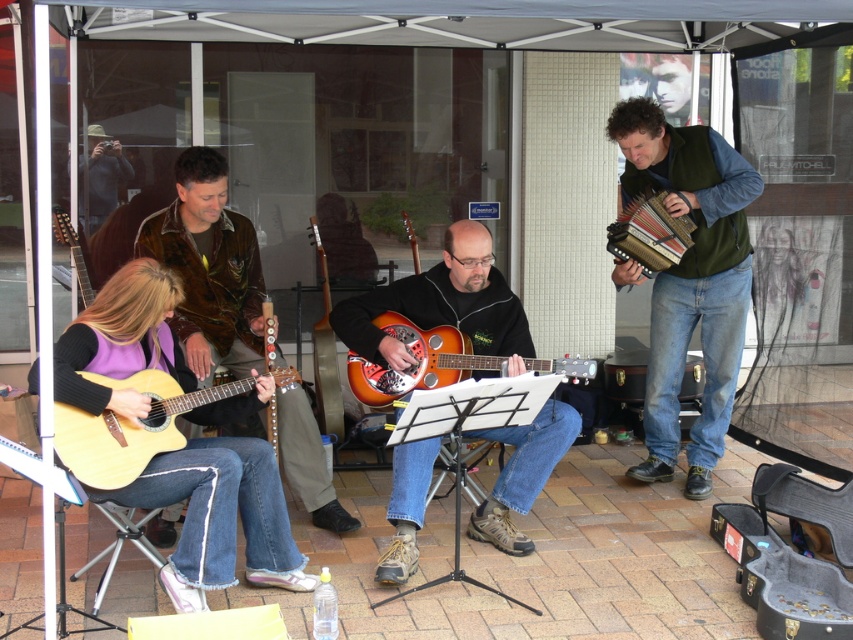
You are a photographer standing in front of the musicians. You notice the leather jacket at center and the sunburst wood resonator guitar at center. Which one is positioned higher in the image?

The leather jacket at center is positioned higher than the sunburst wood resonator guitar at center in the image.

Based on the coordinates provided, which object is located at point (219, 516)?

The point (219, 516) corresponds to the matte yellow guitar at lower left.

You are a photographer trying to capture both the green fabric vest at right and the matte wood guitar at left in a single frame. Based on their positions, which object should you position closer to the right side of your camera viewfinder?

The green fabric vest at right is to the right of the matte wood guitar at left, so you should position the green fabric vest at right closer to the right side of your camera viewfinder.